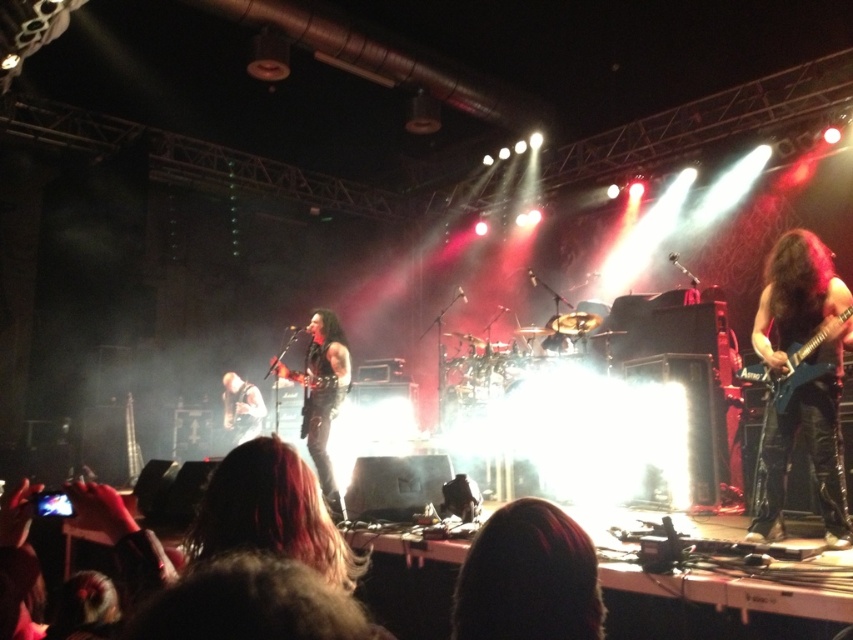
Question: Estimate the real-world distances between objects in this image. Which object is farther from the dark brown hair at center?

Choices:
 (A) shiny black guitar at right
 (B) shiny black electric guitar at right

Answer: (A)

Question: Which of the following is the farthest from the observer?

Choices:
 (A) black leather jacket at center
 (B) shiny dark hair at center
 (C) shiny black electric guitar at center
 (D) shiny black guitar at center

Answer: (D)

Question: Which object appears farthest from the camera in this image?

Choices:
 (A) shiny black guitar at center
 (B) dark brown hair at center
 (C) shiny black guitar at right

Answer: (A)

Question: Does shiny black electric guitar at right appear over shiny black guitar at center?

Choices:
 (A) no
 (B) yes

Answer: (B)

Question: In this image, where is shiny black guitar at right located relative to shiny dark hair at center?

Choices:
 (A) left
 (B) right

Answer: (B)

Question: Is shiny dark hair at center positioned before shiny black guitar at center?

Choices:
 (A) yes
 (B) no

Answer: (A)